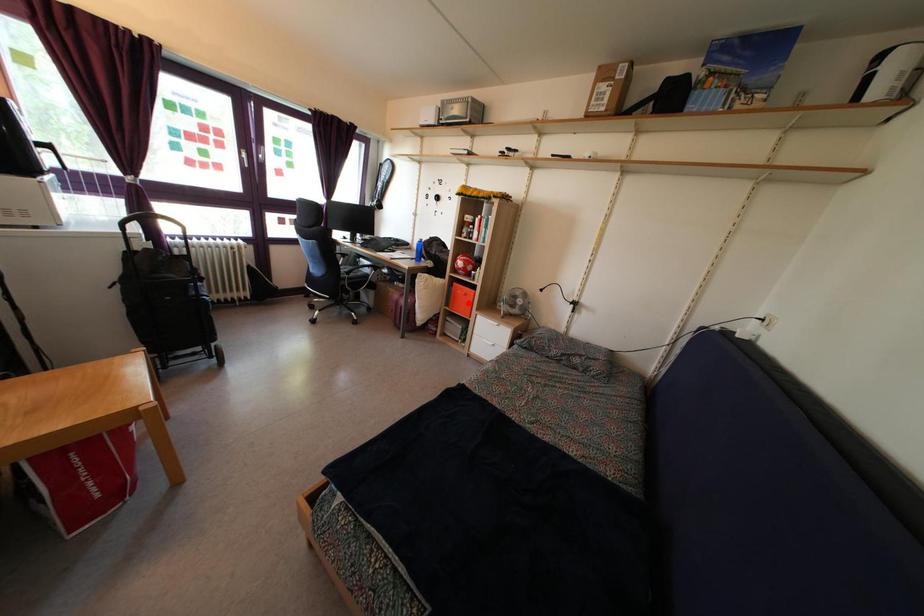
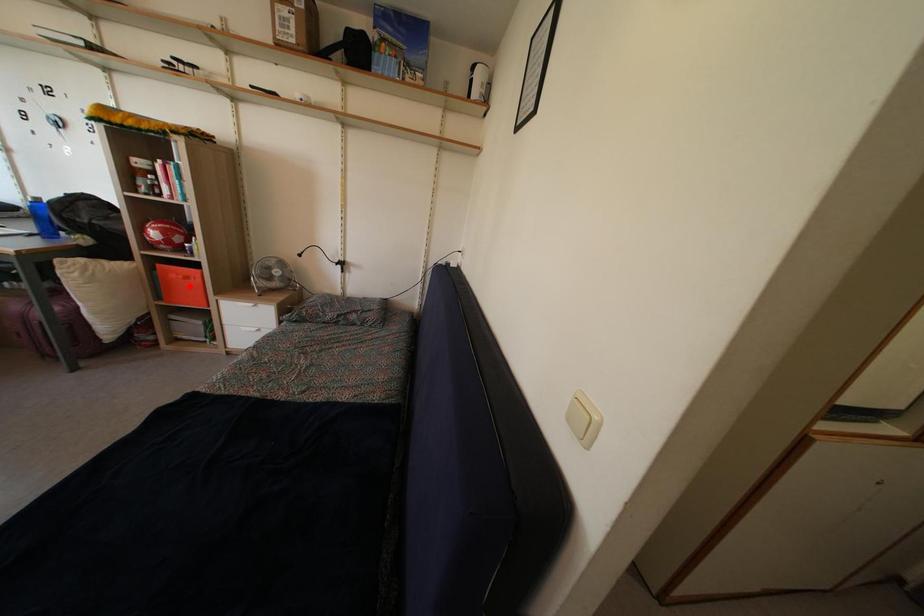
I am providing you with two images of the same scene from different viewpoints. A red point is marked on the first image and another point is marked on the second image. Does the point marked in image1 correspond to the same location as the one in image2?

Yes